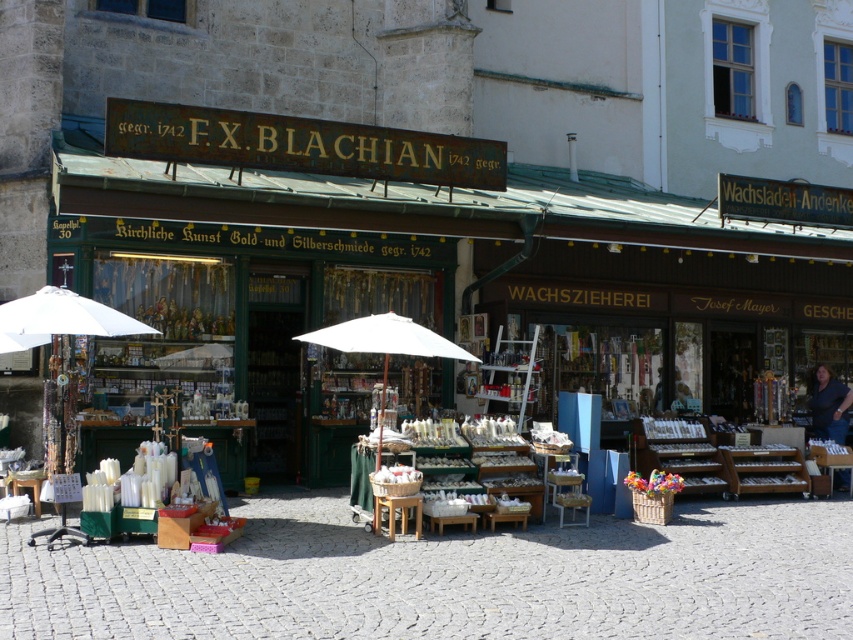
Is white fabric umbrella at left smaller than blue fabric vendor at center?

Indeed, white fabric umbrella at left has a smaller size compared to blue fabric vendor at center.

The height and width of the screenshot is (640, 853). What are the coordinates of `white fabric umbrella at left` in the screenshot? It's located at (59, 317).

Measure the distance between white fabric umbrella at left and camera.

white fabric umbrella at left and camera are 32.16 feet apart from each other.

This screenshot has height=640, width=853. I want to click on white fabric umbrella at left, so click(x=59, y=317).